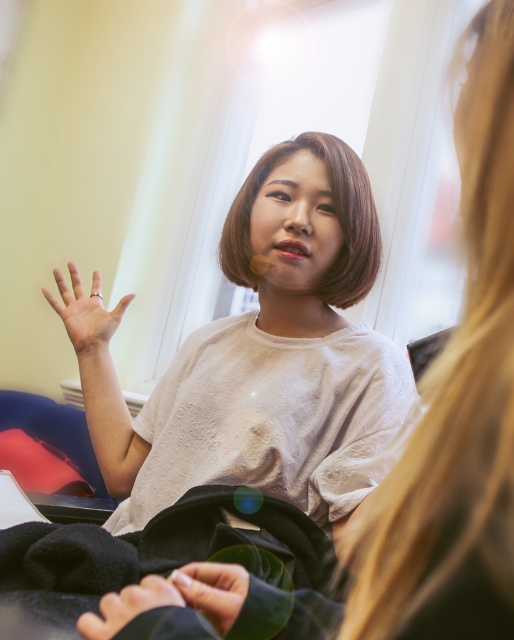
Question: Is silver metallic ring at center in front of smooth black fabric at lower center?

Choices:
 (A) no
 (B) yes

Answer: (A)

Question: Is white matte shirt at center above smooth black fabric at lower center?

Choices:
 (A) yes
 (B) no

Answer: (A)

Question: Which object is closer to the camera taking this photo?

Choices:
 (A) silver metallic ring at center
 (B) smooth black fabric at lower center

Answer: (B)

Question: Considering the real-world distances, which object is closest to the white matte shirt at center?

Choices:
 (A) silver metallic ring at center
 (B) smooth black fabric at lower center
 (C) smooth black hand at center

Answer: (A)

Question: Is silver metallic ring at center further to camera compared to smooth black fabric at lower center?

Choices:
 (A) no
 (B) yes

Answer: (B)

Question: Which object appears farthest from the camera in this image?

Choices:
 (A) white matte shirt at center
 (B) silver metallic ring at center
 (C) smooth black hand at center

Answer: (B)